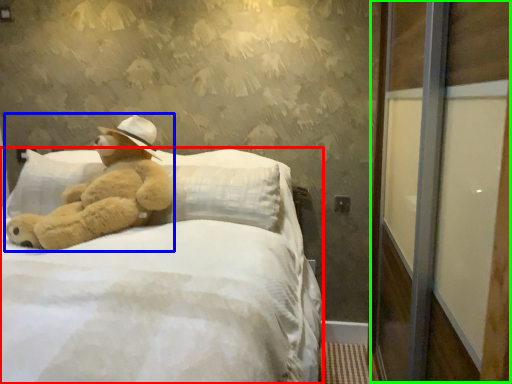
Question: Estimate the real-world distances between objects in this image. Which object is closer to bed (highlighted by a red box), teddy bear (highlighted by a blue box) or screen door (highlighted by a green box)?

Choices:
 (A) teddy bear
 (B) screen door

Answer: (A)